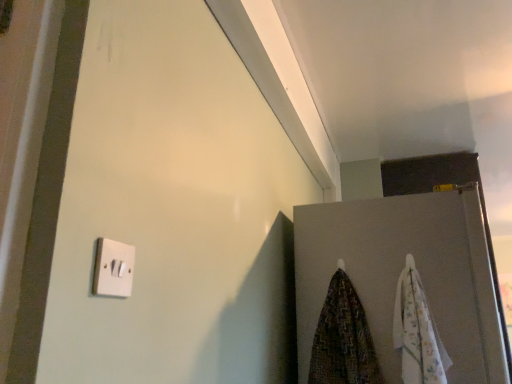
What is the approximate height of white matte door at upper right?

It is 77.16 centimeters.

What is the approximate width of patterned fabric beach towel at lower right, the 1th beach towel in the left-to-right sequence?

patterned fabric beach towel at lower right, the 1th beach towel in the left-to-right sequence, is 17.46 centimeters in width.

Image resolution: width=512 pixels, height=384 pixels. I want to click on floral cotton beach towel at right, which appears as the second beach towel when viewed from the left, so click(417, 332).

You are a GUI agent. You are given a task and a screenshot of the screen. Output one action in this format:
    pyautogui.click(x=<x>, y=<y>)
    Task: Click on the white plastic light switch at lower left
    Image resolution: width=512 pixels, height=384 pixels.
    Given the screenshot: What is the action you would take?
    pyautogui.click(x=113, y=269)

You are a GUI agent. You are given a task and a screenshot of the screen. Output one action in this format:
    pyautogui.click(x=<x>, y=<y>)
    Task: Click on the white matte door at upper right
    
    Given the screenshot: What is the action you would take?
    pyautogui.click(x=399, y=274)

Between white matte door at upper right and floral cotton beach towel at right, which appears as the second beach towel when viewed from the left, which one appears on the left side from the viewer's perspective?

From the viewer's perspective, floral cotton beach towel at right, which appears as the second beach towel when viewed from the left, appears more on the left side.

Considering the relative sizes of white matte door at upper right and floral cotton beach towel at right, which appears as the second beach towel when viewed from the left, in the image provided, is white matte door at upper right bigger than floral cotton beach towel at right, which appears as the second beach towel when viewed from the left,?

Correct, white matte door at upper right is larger in size than floral cotton beach towel at right, which appears as the second beach towel when viewed from the left.

Is white matte door at upper right oriented away from floral cotton beach towel at right, which is the 1th beach towel from right to left?

No, white matte door at upper right's orientation is not away from floral cotton beach towel at right, which is the 1th beach towel from right to left.

Is white matte door at upper right closer to camera compared to floral cotton beach towel at right, which appears as the second beach towel when viewed from the left?

No, it is behind floral cotton beach towel at right, which appears as the second beach towel when viewed from the left.

Can you confirm if white plastic light switch at lower left is bigger than white matte door at upper right?

No.

Does white plastic light switch at lower left lie behind white matte door at upper right?

That is False.

Is white plastic light switch at lower left facing towards white matte door at upper right?

No, white plastic light switch at lower left is not aimed at white matte door at upper right.

Choose the correct answer: Is white plastic light switch at lower left inside white matte door at upper right or outside it?

white plastic light switch at lower left is spatially situated outside white matte door at upper right.

From the image's perspective, would you say white plastic light switch at lower left is shown under floral cotton beach towel at right, which is the 1th beach towel from right to left?

No.

Who is smaller, white plastic light switch at lower left or floral cotton beach towel at right, which appears as the second beach towel when viewed from the left?

With smaller size is white plastic light switch at lower left.

Are white plastic light switch at lower left and floral cotton beach towel at right, which appears as the second beach towel when viewed from the left, located far from each other?

Yes, white plastic light switch at lower left is far from floral cotton beach towel at right, which appears as the second beach towel when viewed from the left.

Based on the photo, is patterned fabric beach towel at lower right, the 1th beach towel in the left-to-right sequence, positioned far away from white plastic light switch at lower left?

They are positioned close to each other.

Would you say patterned fabric beach towel at lower right, marked as the second beach towel in a right-to-left arrangement, is to the left or to the right of white plastic light switch at lower left in the picture?

patterned fabric beach towel at lower right, marked as the second beach towel in a right-to-left arrangement, is positioned on white plastic light switch at lower left's right side.

From a real-world perspective, relative to white plastic light switch at lower left, is patterned fabric beach towel at lower right, the 1th beach towel in the left-to-right sequence, vertically above or below?

In terms of real-world spatial position, patterned fabric beach towel at lower right, the 1th beach towel in the left-to-right sequence, is below white plastic light switch at lower left.

Is floral cotton beach towel at right, which is the 1th beach towel from right to left, positioned beyond the bounds of patterned fabric beach towel at lower right, marked as the second beach towel in a right-to-left arrangement?

Yes, floral cotton beach towel at right, which is the 1th beach towel from right to left, is not within patterned fabric beach towel at lower right, marked as the second beach towel in a right-to-left arrangement.

From the image's perspective, is floral cotton beach towel at right, which appears as the second beach towel when viewed from the left, located above patterned fabric beach towel at lower right, marked as the second beach towel in a right-to-left arrangement?

Yes, from the image's perspective, floral cotton beach towel at right, which appears as the second beach towel when viewed from the left, is on top of patterned fabric beach towel at lower right, marked as the second beach towel in a right-to-left arrangement.

Is floral cotton beach towel at right, which is the 1th beach towel from right to left, bigger or smaller than patterned fabric beach towel at lower right, the 1th beach towel in the left-to-right sequence?

floral cotton beach towel at right, which is the 1th beach towel from right to left, is smaller than patterned fabric beach towel at lower right, the 1th beach towel in the left-to-right sequence.

Considering the sizes of objects floral cotton beach towel at right, which is the 1th beach towel from right to left, and patterned fabric beach towel at lower right, marked as the second beach towel in a right-to-left arrangement, in the image provided, who is thinner, floral cotton beach towel at right, which is the 1th beach towel from right to left, or patterned fabric beach towel at lower right, marked as the second beach towel in a right-to-left arrangement,?

floral cotton beach towel at right, which is the 1th beach towel from right to left.

Is patterned fabric beach towel at lower right, the 1th beach towel in the left-to-right sequence, facing away from floral cotton beach towel at right, which appears as the second beach towel when viewed from the left?

patterned fabric beach towel at lower right, the 1th beach towel in the left-to-right sequence, is not turned away from floral cotton beach towel at right, which appears as the second beach towel when viewed from the left.

Is patterned fabric beach towel at lower right, marked as the second beach towel in a right-to-left arrangement, positioned beyond the bounds of floral cotton beach towel at right, which is the 1th beach towel from right to left?

Yes, patterned fabric beach towel at lower right, marked as the second beach towel in a right-to-left arrangement, is outside of floral cotton beach towel at right, which is the 1th beach towel from right to left.

In the scene shown: Is white matte door at upper right surrounding patterned fabric beach towel at lower right, marked as the second beach towel in a right-to-left arrangement?

No, patterned fabric beach towel at lower right, marked as the second beach towel in a right-to-left arrangement, is not inside white matte door at upper right.

Based on the photo, considering the relative positions of white matte door at upper right and patterned fabric beach towel at lower right, the 1th beach towel in the left-to-right sequence, in the image provided, is white matte door at upper right to the left of patterned fabric beach towel at lower right, the 1th beach towel in the left-to-right sequence, from the viewer's perspective?

No, white matte door at upper right is not to the left of patterned fabric beach towel at lower right, the 1th beach towel in the left-to-right sequence.

In the scene shown: Considering the sizes of objects white matte door at upper right and patterned fabric beach towel at lower right, marked as the second beach towel in a right-to-left arrangement, in the image provided, who is shorter, white matte door at upper right or patterned fabric beach towel at lower right, marked as the second beach towel in a right-to-left arrangement,?

Standing shorter between the two is patterned fabric beach towel at lower right, marked as the second beach towel in a right-to-left arrangement.

From a real-world perspective, between white matte door at upper right and patterned fabric beach towel at lower right, marked as the second beach towel in a right-to-left arrangement, who is vertically higher?

From a 3D spatial view, white matte door at upper right is above.

Which beach towel is the 1st one when counting from the left side of the white matte door at upper right? Please provide its 2D coordinates.

[(417, 332)]

The image size is (512, 384). What are the coordinates of `door on the right of the white plastic light switch at lower left` in the screenshot? It's located at (399, 274).

Which object lies further to the anchor point floral cotton beach towel at right, which is the 1th beach towel from right to left, white plastic light switch at lower left or patterned fabric beach towel at lower right, marked as the second beach towel in a right-to-left arrangement?

white plastic light switch at lower left is positioned further to the anchor floral cotton beach towel at right, which is the 1th beach towel from right to left.

Looking at the image, which one is located further to white plastic light switch at lower left, patterned fabric beach towel at lower right, the 1th beach towel in the left-to-right sequence, or white matte door at upper right?

white matte door at upper right is further to white plastic light switch at lower left.

Considering their positions, is white matte door at upper right positioned further to white plastic light switch at lower left than floral cotton beach towel at right, which appears as the second beach towel when viewed from the left?

Based on the image, white matte door at upper right appears to be further to white plastic light switch at lower left.

Estimate the real-world distances between objects in this image. Which object is closer to patterned fabric beach towel at lower right, marked as the second beach towel in a right-to-left arrangement, floral cotton beach towel at right, which is the 1th beach towel from right to left, or white plastic light switch at lower left?

floral cotton beach towel at right, which is the 1th beach towel from right to left, is closer to patterned fabric beach towel at lower right, marked as the second beach towel in a right-to-left arrangement.

Looking at the image, which one is located closer to floral cotton beach towel at right, which is the 1th beach towel from right to left, white matte door at upper right or patterned fabric beach towel at lower right, the 1th beach towel in the left-to-right sequence?

white matte door at upper right is positioned closer to the anchor floral cotton beach towel at right, which is the 1th beach towel from right to left.

From the picture: Which object lies nearer to the anchor point patterned fabric beach towel at lower right, marked as the second beach towel in a right-to-left arrangement, white matte door at upper right or white plastic light switch at lower left?

Among the two, white matte door at upper right is located nearer to patterned fabric beach towel at lower right, marked as the second beach towel in a right-to-left arrangement.

Estimate the real-world distances between objects in this image. Which object is further from floral cotton beach towel at right, which appears as the second beach towel when viewed from the left, white plastic light switch at lower left or white matte door at upper right?

white plastic light switch at lower left is further to floral cotton beach towel at right, which appears as the second beach towel when viewed from the left.

Based on their spatial positions, is patterned fabric beach towel at lower right, marked as the second beach towel in a right-to-left arrangement, or floral cotton beach towel at right, which is the 1th beach towel from right to left, closer to white matte door at upper right?

Based on the image, floral cotton beach towel at right, which is the 1th beach towel from right to left, appears to be nearer to white matte door at upper right.

Identify the location of beach towel between white plastic light switch at lower left and floral cotton beach towel at right, which is the 1th beach towel from right to left, from left to right. This screenshot has height=384, width=512. (343, 339).

Identify the location of beach towel situated between patterned fabric beach towel at lower right, marked as the second beach towel in a right-to-left arrangement, and white matte door at upper right from left to right. The width and height of the screenshot is (512, 384). (417, 332).